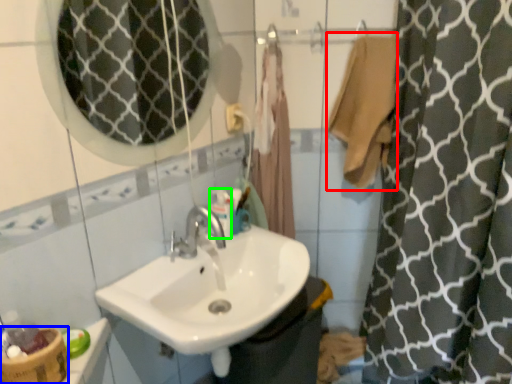
Question: Which object is the farthest from bath towel (highlighted by a red box)? Choose among these: basket (highlighted by a blue box) or mouthwash (highlighted by a green box).

Choices:
 (A) basket
 (B) mouthwash

Answer: (A)